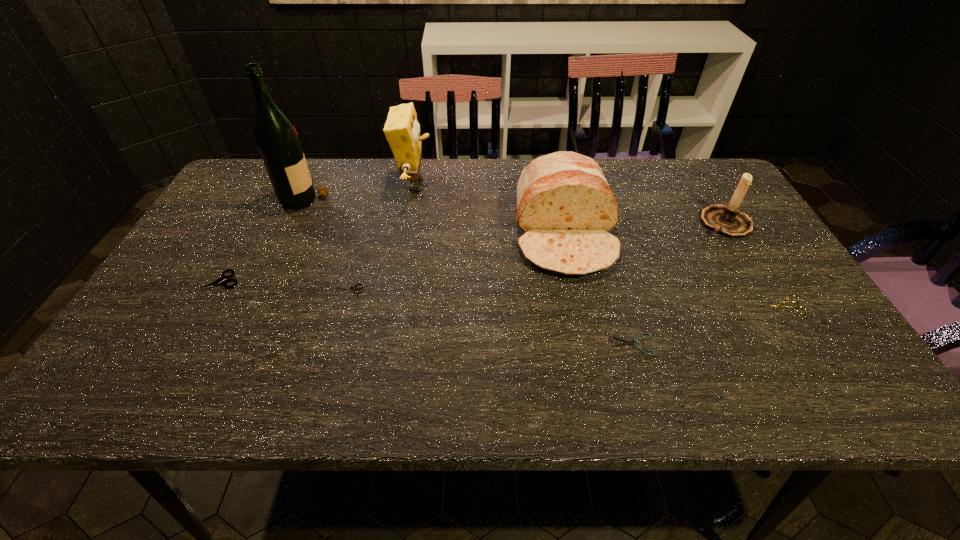
Identify the location of free spot between the second nearest shears and the bread. (672, 269).

Locate which object ranks seventh in proximity to the candle holder. Please provide its 2D coordinates. Your answer should be formatted as a tuple, i.e. [(x, y)], where the tuple contains the x and y coordinates of a point satisfying the conditions above.

[(219, 281)]

Identify which object is the nearest to the third farthest shears. Please provide its 2D coordinates. Your answer should be formatted as a tuple, i.e. [(x, y)], where the tuple contains the x and y coordinates of a point satisfying the conditions above.

[(727, 220)]

Image resolution: width=960 pixels, height=540 pixels. Identify the location of shears identified as the closest to the third object from left to right. (219, 281).

Select which shears appears as the second closest to the nearest object. Please provide its 2D coordinates. Your answer should be formatted as a tuple, i.e. [(x, y)], where the tuple contains the x and y coordinates of a point satisfying the conditions above.

[(355, 287)]

At what (x,y) coordinates should I click in order to perform the action: click on vacant point that satisfies the following two spatial constraints: 1. on the front side of the candle holder; 2. on the left side of the third farthest shears. Please return your answer as a coordinate pair (x, y). The image size is (960, 540). Looking at the image, I should click on (775, 306).

This screenshot has height=540, width=960. I want to click on vacant area in the image that satisfies the following two spatial constraints: 1. on the front side of the seventh farthest object; 2. on the right side of the wine bottle, so click(256, 306).